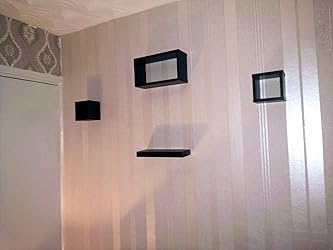
Where is `door`? This screenshot has width=333, height=250. door is located at coordinates (31, 144).